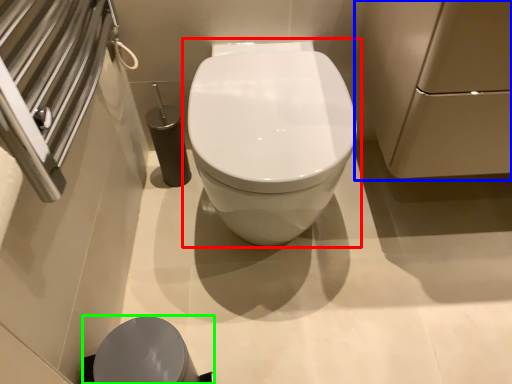
Question: Considering the real-world distances, which object is farthest from toilet (highlighted by a red box)? screen door (highlighted by a blue box) or porcelain (highlighted by a green box)?

Choices:
 (A) screen door
 (B) porcelain

Answer: (B)